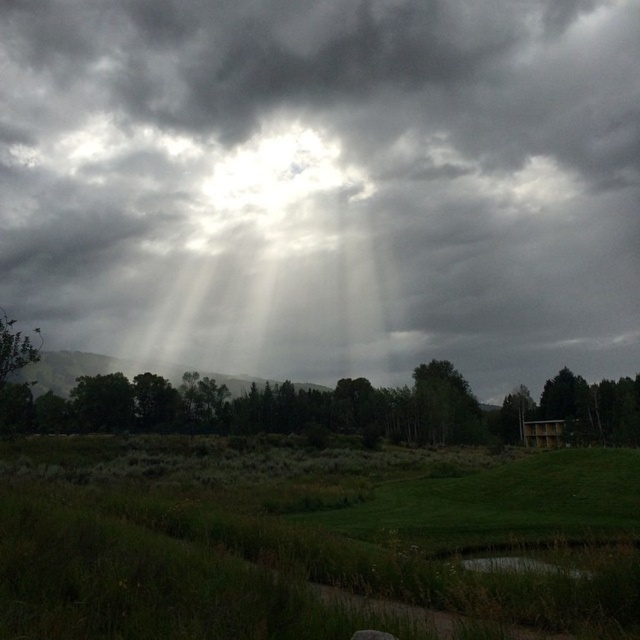
Question: Which object appears farthest from the camera in this image?

Choices:
 (A) green matte tree at lower right
 (B) dark gray cloud at upper center
 (C) green grass at center
 (D) green matte tree at center

Answer: (B)

Question: In this image, where is green grass at center located relative to green matte tree at lower right?

Choices:
 (A) left
 (B) right

Answer: (A)

Question: Among these points, which one is nearest to the camera?

Choices:
 (A) (42, 150)
 (B) (436, 388)
 (C) (90, 538)

Answer: (C)

Question: Considering the relative positions of dark gray cloud at upper center and green grass at center in the image provided, where is dark gray cloud at upper center located with respect to green grass at center?

Choices:
 (A) right
 (B) left

Answer: (A)

Question: Which point is farther from the camera taking this photo?

Choices:
 (A) (556, 384)
 (B) (484, 380)

Answer: (B)

Question: Is green matte tree at center below green matte tree at lower right?

Choices:
 (A) yes
 (B) no

Answer: (B)